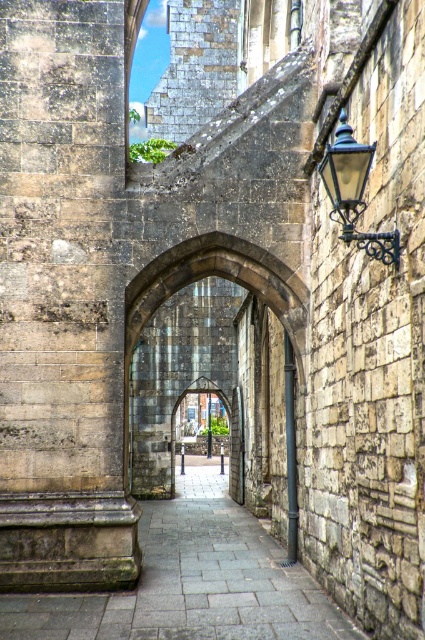
You are an architect examining the structure of the courtyard entrance. Based on the scene, which object is located above the other between the gray stone pillar at left and the stone archway at center?

The gray stone pillar at left is positioned over the stone archway at center, meaning it is located above the archway.

You are a painter planning to set up an easel in front of the stone archway at center and the black wrought iron lamp at upper right. Since you want to capture the full height of both objects in your painting, which object should you position closer to the edge of your canvas to ensure it isn t cropped?

The stone archway at center is much taller than the black wrought iron lamp at upper right, so to capture its full height without cropping, you should position the stone archway at center closer to the edge of your canvas. This allows more space for its height while keeping the smaller lamp within the frame.

In the scene shown: You are a traveler approaching the narrow stone archway. You see the gray stone path at center and the black wrought iron lamp at upper right. Which object is taller? Please answer based on their heights.

The black wrought iron lamp at upper right is taller than the gray stone path at center.